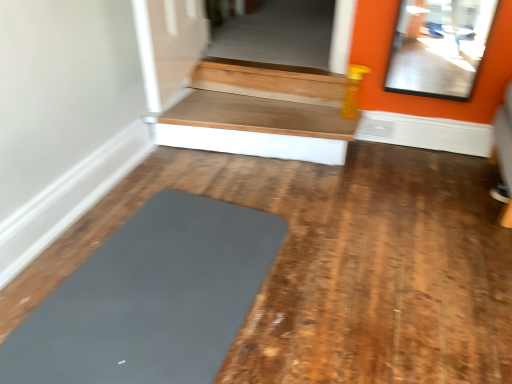
Question: From a real-world perspective, is matte gray yoga mat at center positioned above or below wooden at upper right?

Choices:
 (A) above
 (B) below

Answer: (B)

Question: Is matte gray yoga mat at center in front of or behind wooden at upper right in the image?

Choices:
 (A) front
 (B) behind

Answer: (A)

Question: Looking at their shapes, would you say matte gray yoga mat at center is wider or thinner than wooden at upper right?

Choices:
 (A) wide
 (B) thin

Answer: (A)

Question: Based on their sizes in the image, would you say wooden at upper right is bigger or smaller than matte gray yoga mat at center?

Choices:
 (A) big
 (B) small

Answer: (A)

Question: Do you think wooden at upper right is within matte gray yoga mat at center, or outside of it?

Choices:
 (A) outside
 (B) inside

Answer: (A)

Question: Visually, is wooden at upper right positioned to the left or to the right of matte gray yoga mat at center?

Choices:
 (A) right
 (B) left

Answer: (A)

Question: From the image's perspective, is wooden at upper right located above or below matte gray yoga mat at center?

Choices:
 (A) above
 (B) below

Answer: (A)